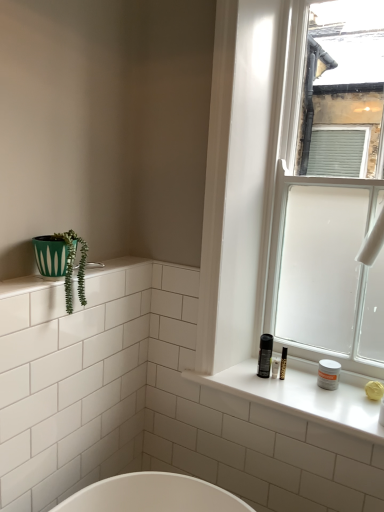
What is the approximate height of white glossy window sill at right?

white glossy window sill at right is 2.17 inches in height.

Find the location of a particular element. The height and width of the screenshot is (512, 384). green matte pot at left is located at coordinates (72, 267).

Measure the distance between point (x=359, y=359) and camera.

The distance of point (x=359, y=359) from camera is 5.11 feet.

The image size is (384, 512). Describe the element at coordinates (333, 200) in the screenshot. I see `white glass window at right` at that location.

Find the location of a particular element. The width and height of the screenshot is (384, 512). white matte jar at window, which is the 1th toiletry in right-to-left order is located at coordinates (328, 374).

I want to click on white glossy window sill at right, so click(303, 396).

Based on the photo, considering the sizes of objects white matte jar at window, which is the 1th toiletry in right-to-left order, and white glossy window sill at right in the image provided, who is thinner, white matte jar at window, which is the 1th toiletry in right-to-left order, or white glossy window sill at right?

Thinner between the two is white matte jar at window, which is the 1th toiletry in right-to-left order.

Is white matte jar at window, which is counted as the 2th toiletry, starting from the left, next to white glossy window sill at right and touching it?

There is a gap between white matte jar at window, which is counted as the 2th toiletry, starting from the left, and white glossy window sill at right.

In terms of height, does white matte jar at window, which is the 1th toiletry in right-to-left order, look taller or shorter compared to white glossy window sill at right?

white matte jar at window, which is the 1th toiletry in right-to-left order, is taller than white glossy window sill at right.

From the image's perspective, is white glossy window sill at right below white glass window at right?

Correct, white glossy window sill at right appears lower than white glass window at right in the image.

Considering the sizes of objects white glossy window sill at right and white glass window at right in the image provided, who is taller, white glossy window sill at right or white glass window at right?

white glass window at right is taller.

Which of these two, white glossy window sill at right or white glass window at right, is bigger?

Bigger between the two is white glass window at right.

Are white glossy window sill at right and white glass window at right located far from each other?

No, white glossy window sill at right is in close proximity to white glass window at right.

Is green matte pot at left facing towards white glossy window sill at right?

No, green matte pot at left is not aimed at white glossy window sill at right.

Can you tell me how much green matte pot at left and white glossy window sill at right differ in facing direction?

The facing directions of green matte pot at left and white glossy window sill at right are 88.9 degrees apart.

From a real-world perspective, between green matte pot at left and white glossy window sill at right, who is vertically lower?

From a 3D spatial view, white glossy window sill at right is below.

Is point (71, 303) positioned behind point (369, 433)?

Yes, point (71, 303) is farther from viewer.

Is white glossy window sill at right at the right side of white matte jar at window, which is counted as the 2th toiletry, starting from the left?

No.

At what (x,y) coordinates should I click in order to perform the action: click on toiletry on the right of white glossy window sill at right. Please return your answer as a coordinate pair (x, y). Image resolution: width=384 pixels, height=512 pixels. Looking at the image, I should click on (328, 374).

Does white glossy window sill at right contain white matte jar at window, which is the 1th toiletry in right-to-left order?

Yes, white matte jar at window, which is the 1th toiletry in right-to-left order, can be found within white glossy window sill at right.

From a real-world perspective, is white glossy window sill at right beneath white matte jar at window, which is counted as the 2th toiletry, starting from the left?

Indeed, from a real-world perspective, white glossy window sill at right is positioned beneath white matte jar at window, which is counted as the 2th toiletry, starting from the left.

From a real-world perspective, who is located lower, green matte pot at left or white matte jar at window, which is the 1th toiletry in right-to-left order?

white matte jar at window, which is the 1th toiletry in right-to-left order, from a real-world perspective.

What's the angular difference between green matte pot at left and white matte jar at window, which is counted as the 2th toiletry, starting from the left,'s facing directions?

green matte pot at left and white matte jar at window, which is counted as the 2th toiletry, starting from the left, are facing 89.2 degrees away from each other.

Considering the relative sizes of green matte pot at left and white matte jar at window, which is the 1th toiletry in right-to-left order, in the image provided, is green matte pot at left shorter than white matte jar at window, which is the 1th toiletry in right-to-left order,?

Incorrect, the height of green matte pot at left does not fall short of that of white matte jar at window, which is the 1th toiletry in right-to-left order.

Between green matte pot at left and white matte jar at window, which is counted as the 2th toiletry, starting from the left, which one has larger width?

With larger width is green matte pot at left.

Can you confirm if matte black spray can at right, positioned as the 2th toiletry in right-to-left order, is shorter than white glass window at right?

Correct, matte black spray can at right, positioned as the 2th toiletry in right-to-left order, is not as tall as white glass window at right.

Between matte black spray can at right, arranged as the first toiletry when viewed from the left, and white glass window at right, which one has larger size?

white glass window at right.

Does matte black spray can at right, positioned as the 2th toiletry in right-to-left order, contain white glass window at right?

No.

In the scene shown: Is matte black spray can at right, positioned as the 2th toiletry in right-to-left order, far from white glass window at right?

No.

Can you confirm if white matte jar at window, which is the 1th toiletry in right-to-left order, is bigger than green matte pot at left?

Actually, white matte jar at window, which is the 1th toiletry in right-to-left order, might be smaller than green matte pot at left.

Considering the relative sizes of white matte jar at window, which is the 1th toiletry in right-to-left order, and green matte pot at left in the image provided, is white matte jar at window, which is the 1th toiletry in right-to-left order, shorter than green matte pot at left?

Indeed, white matte jar at window, which is the 1th toiletry in right-to-left order, has a lesser height compared to green matte pot at left.

Is white matte jar at window, which is the 1th toiletry in right-to-left order, positioned with its back to green matte pot at left?

No, white matte jar at window, which is the 1th toiletry in right-to-left order, is not facing the opposite direction of green matte pot at left.

Is white matte jar at window, which is counted as the 2th toiletry, starting from the left, wider than green matte pot at left?

Incorrect, the width of white matte jar at window, which is counted as the 2th toiletry, starting from the left, does not surpass that of green matte pot at left.

Where is `toiletry located on the right of white glossy window sill at right`? This screenshot has width=384, height=512. toiletry located on the right of white glossy window sill at right is located at coordinates (328, 374).

Find the location of a particular element. Image resolution: width=384 pixels, height=512 pixels. window lying behind the white glossy window sill at right is located at coordinates (333, 200).

When comparing their distances from white glass window at right, does green matte pot at left or white glossy window sill at right seem further?

The object further to white glass window at right is green matte pot at left.

Estimate the real-world distances between objects in this image. Which object is further from white matte jar at window, which is counted as the 2th toiletry, starting from the left, matte black spray can at right, positioned as the 2th toiletry in right-to-left order, or green matte pot at left?

green matte pot at left is positioned further to the anchor white matte jar at window, which is counted as the 2th toiletry, starting from the left.

Considering their positions, is white glass window at right positioned closer to green matte pot at left than matte black spray can at right, arranged as the first toiletry when viewed from the left?

The object closer to green matte pot at left is matte black spray can at right, arranged as the first toiletry when viewed from the left.

Which object lies nearer to the anchor point green matte pot at left, matte black spray can at right, arranged as the first toiletry when viewed from the left, or white glass window at right?

Based on the image, matte black spray can at right, arranged as the first toiletry when viewed from the left, appears to be nearer to green matte pot at left.

Estimate the real-world distances between objects in this image. Which object is further from white glossy window sill at right, matte black spray can at right, positioned as the 2th toiletry in right-to-left order, or green matte pot at left?

The object further to white glossy window sill at right is green matte pot at left.

From the image, which object appears to be farther from green matte pot at left, white glass window at right or white glossy window sill at right?

white glass window at right lies further to green matte pot at left than the other object.

Looking at the image, which one is located closer to white glossy window sill at right, white glass window at right or white matte jar at window, which is counted as the 2th toiletry, starting from the left?

white matte jar at window, which is counted as the 2th toiletry, starting from the left.

Estimate the real-world distances between objects in this image. Which object is closer to white glass window at right, white matte jar at window, which is the 1th toiletry in right-to-left order, or matte black spray can at right, positioned as the 2th toiletry in right-to-left order?

matte black spray can at right, positioned as the 2th toiletry in right-to-left order, lies closer to white glass window at right than the other object.

The width and height of the screenshot is (384, 512). What are the coordinates of `toiletry between green matte pot at left and white matte jar at window, which is the 1th toiletry in right-to-left order, in the horizontal direction` in the screenshot? It's located at (265, 355).

The width and height of the screenshot is (384, 512). I want to click on window sill between green matte pot at left and white matte jar at window, which is the 1th toiletry in right-to-left order, so click(x=303, y=396).

Where is `window sill between green matte pot at left and white glass window at right`? window sill between green matte pot at left and white glass window at right is located at coordinates (303, 396).

I want to click on toiletry situated between green matte pot at left and white glossy window sill at right from left to right, so click(265, 355).